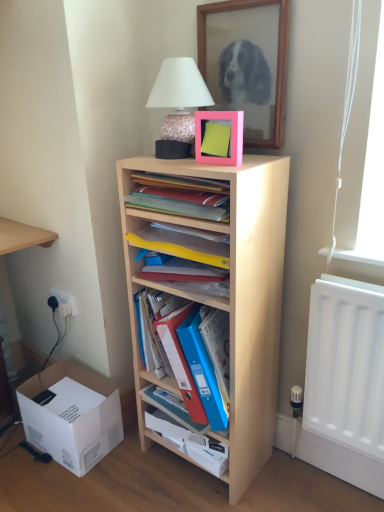
Locate an element on the screen. Image resolution: width=384 pixels, height=512 pixels. unoccupied area in front of white cardboard box at lower left is located at coordinates (70, 486).